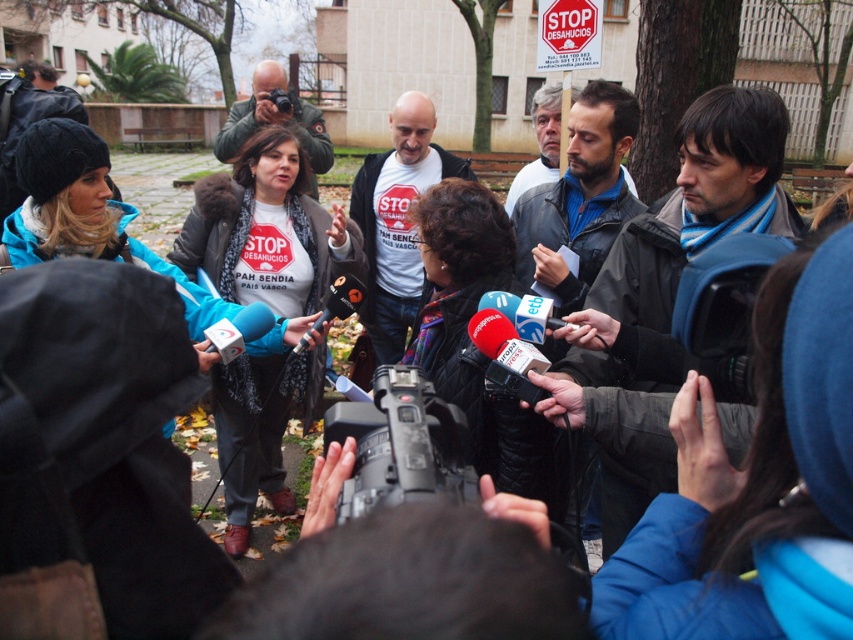
You are a journalist who needs to set up your equipment for a live broadcast. You have a black plastic video camera at center. Where exactly should you place it to align with the existing setup?

The black plastic video camera at center should be placed at point [401,444] to align with the existing setup.

You are a photographer at the event and want to position yourself so that both the black plastic video camera at center and the matte black camera at upper center are visible in your shot. Which camera should you place higher in your frame?

The matte black camera at upper center should be placed higher in your frame because it is located above the black plastic video camera at center.

You are a photographer at the scene and need to choose between the black plastic video camera at center and the matte black camera at upper center. Which one has a wider field of view?

The black plastic video camera at center might be wider than matte black camera at upper center, so it likely has a wider field of view.